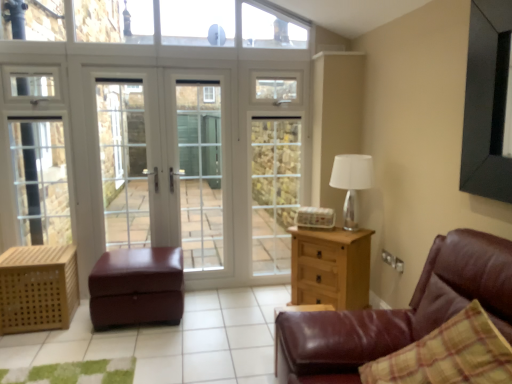
The height and width of the screenshot is (384, 512). Find the location of `vacant space situated above wooden crate at lower left (from a real-world perspective)`. vacant space situated above wooden crate at lower left (from a real-world perspective) is located at coordinates (38, 251).